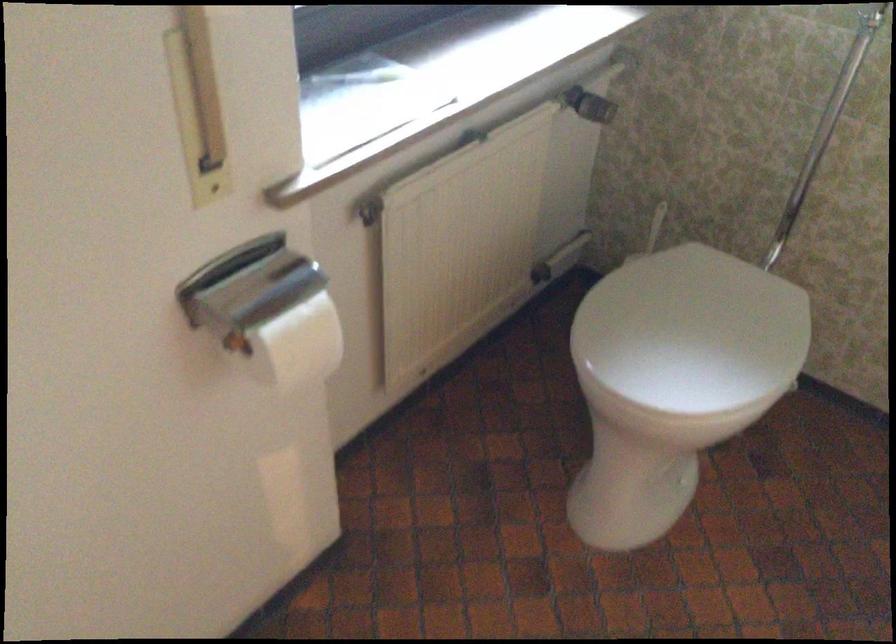
Find where to pull the toilet flush lever. Please return your answer as a coordinate pair (x, y).

(824, 129)